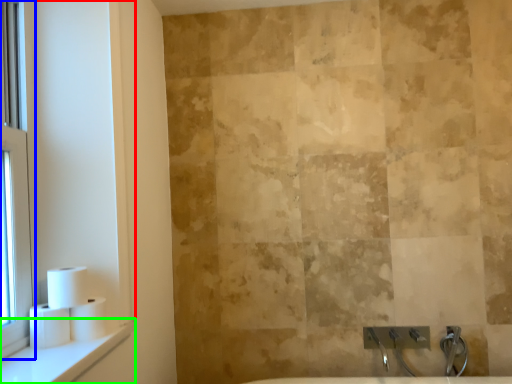
Question: Based on their relative distances, which object is nearer to window frame (highlighted by a red box)? Choose from window (highlighted by a blue box) and window sill (highlighted by a green box).

Choices:
 (A) window
 (B) window sill

Answer: (A)